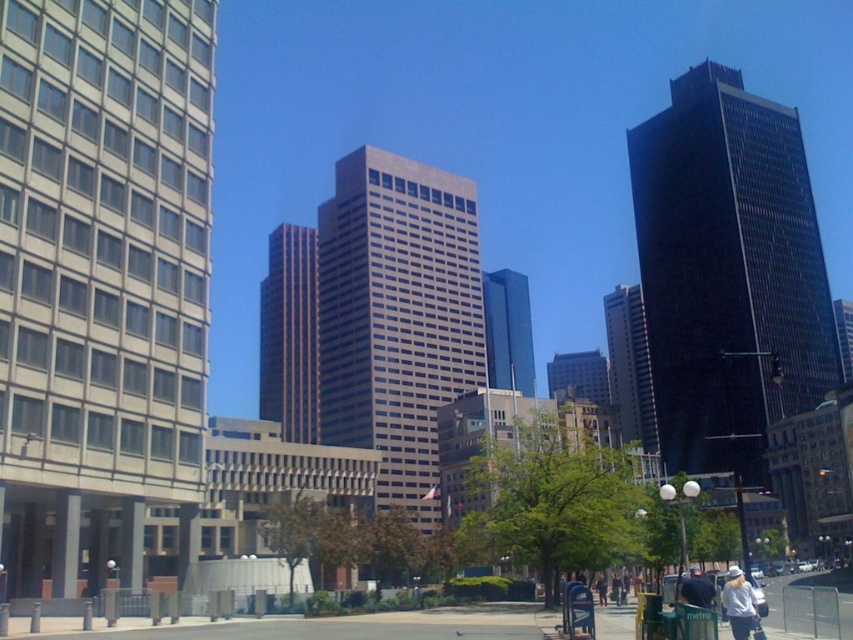
Question: Which object is farther from the camera taking this photo?

Choices:
 (A) white cotton shirt at lower right
 (B) gray concrete pavement at lower center

Answer: (B)

Question: Which object is farther from the camera taking this photo?

Choices:
 (A) white cotton shirt at lower right
 (B) gray concrete pavement at lower center

Answer: (B)

Question: Does gray concrete pavement at lower center appear on the left side of white cotton shirt at lower right?

Choices:
 (A) yes
 (B) no

Answer: (A)

Question: Observing the image, what is the correct spatial positioning of gray concrete pavement at lower center in reference to white cotton shirt at lower right?

Choices:
 (A) left
 (B) right

Answer: (A)

Question: Observing the image, what is the correct spatial positioning of gray concrete pavement at lower center in reference to white cotton shirt at lower right?

Choices:
 (A) above
 (B) below

Answer: (B)